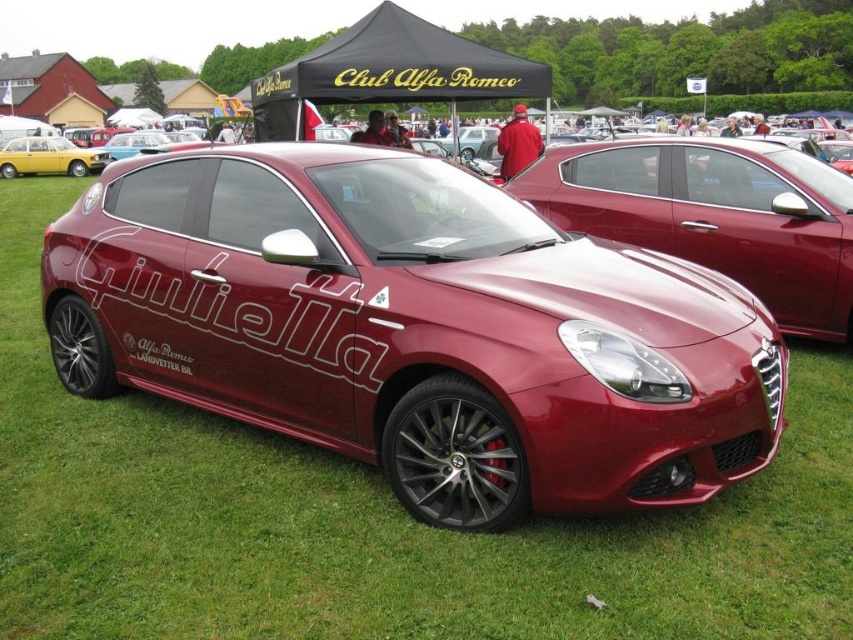
Is point (828, 188) closer to viewer compared to point (74, 154)?

Yes, it is in front of point (74, 154).

Between point (708, 200) and point (16, 168), which one is positioned in front?

Positioned in front is point (708, 200).

The height and width of the screenshot is (640, 853). In order to click on glossy metallic car at center in this screenshot , I will do `click(714, 214)`.